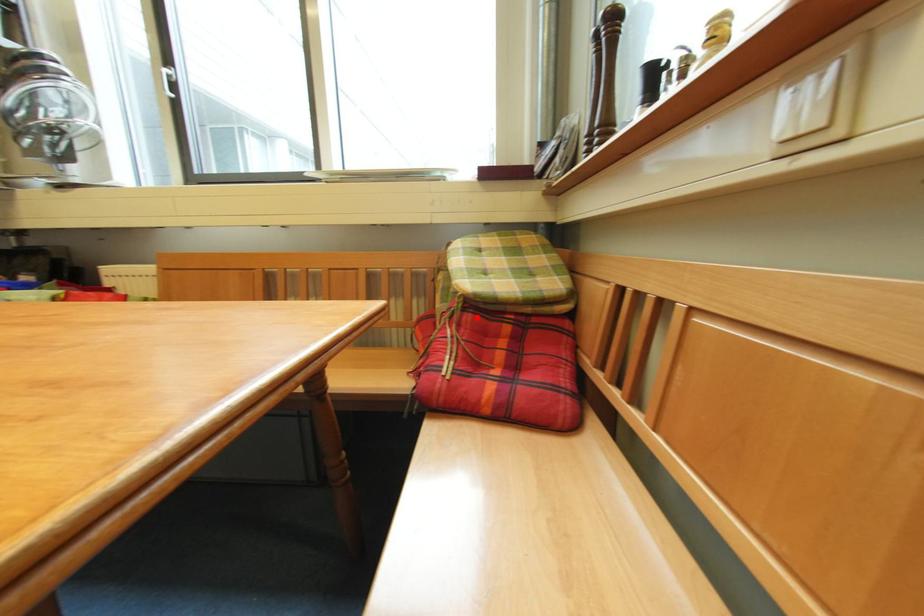
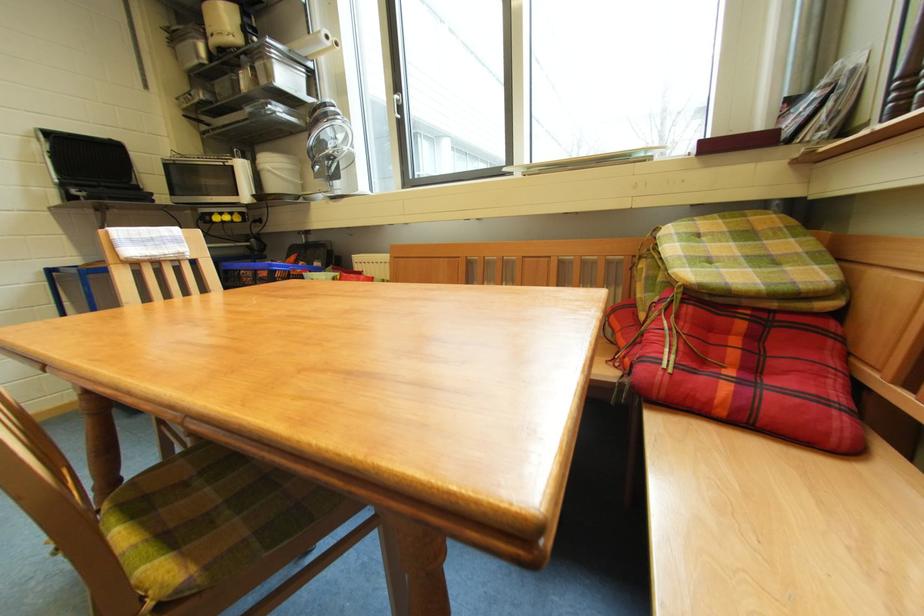
Find the pixel in the second image that matches the highlighted location in the first image.

(698, 310)